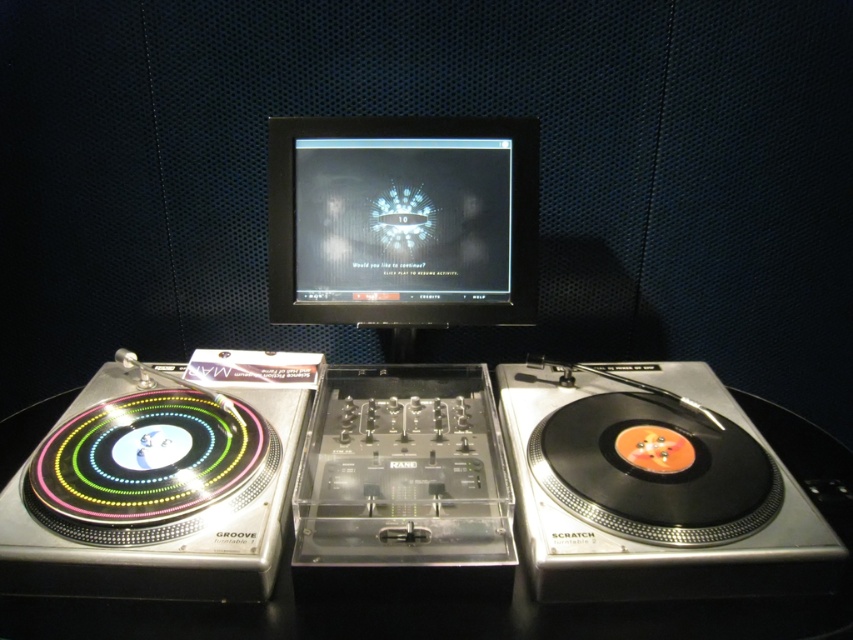
You are a DJ trying to locate your equipment. You see the black vinyl record at right and the black glossy monitor at center. Which one is positioned further to the right side of the DJ setup?

The black vinyl record at right is positioned further to the right side of the DJ setup compared to the black glossy monitor at center.